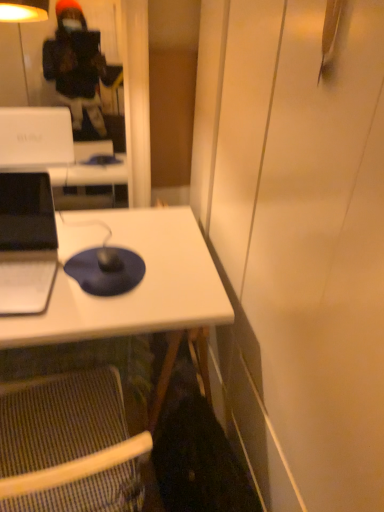
What are the coordinates of `free point above white matte desk at center (from a real-world perspective)` in the screenshot? It's located at (110, 259).